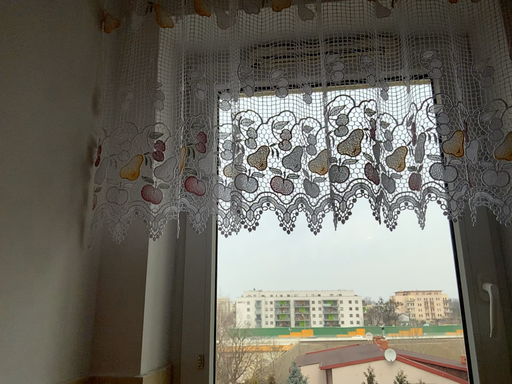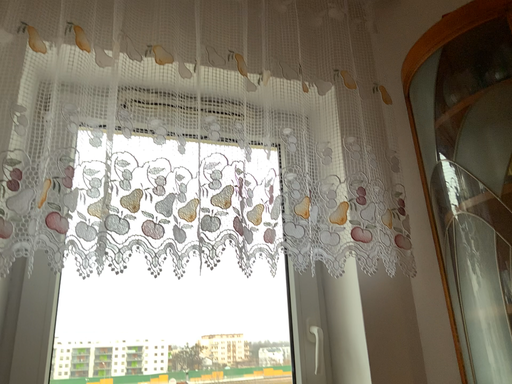
Question: Which way did the camera rotate in the video?

Choices:
 (A) rotated left
 (B) rotated right

Answer: (B)